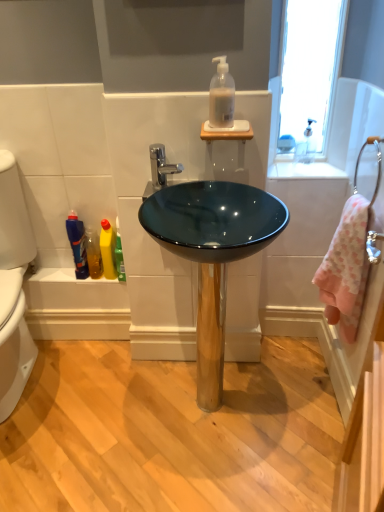
Question: From a real-world perspective, relative to blue glossy mouthwash at lower left, is pink terry cloth towel at right vertically above or below?

Choices:
 (A) below
 (B) above

Answer: (B)

Question: From their relative heights in the image, would you say pink terry cloth towel at right is taller or shorter than blue glossy mouthwash at lower left?

Choices:
 (A) tall
 (B) short

Answer: (A)

Question: Considering the real-world distances, which object is farthest from the yellow plastic bottle at lower left, the first cleaning product from the bottom?

Choices:
 (A) clear glass faucet at upper right
 (B) white glossy countertop at upper right
 (C) glossy glass bowl at center
 (D) translucent yellow liquid at lower left
 (E) blue glossy mouthwash at lower left

Answer: (A)

Question: Considering the real-world distances, which object is closest to the chrome metallic faucet at center?

Choices:
 (A) blue glossy mouthwash at lower left
 (B) silver metallic towel bar at right
 (C) translucent yellow liquid at lower left
 (D) clear glass faucet at upper right
 (E) pink terry cloth towel at right

Answer: (A)